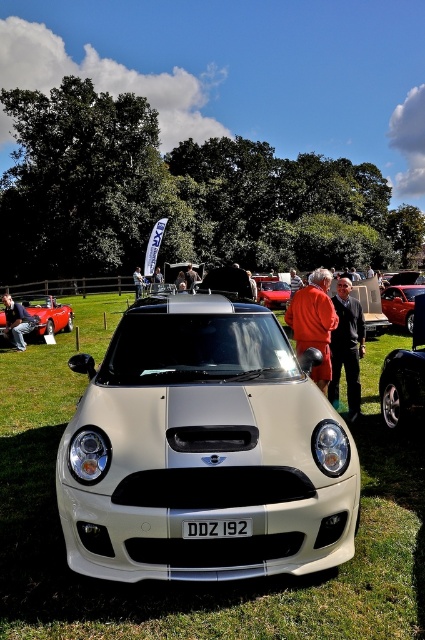
Looking at this image, who is more distant from viewer, (190, 532) or (10, 321)?

The point (10, 321) is more distant.

What do you see at coordinates (217, 529) in the screenshot?
I see `white plastic license plate at center` at bounding box center [217, 529].

Identify the location of white plastic license plate at center. The image size is (425, 640). click(217, 529).

Is dark brown leather jacket at center above denim jacket at lower left?

No, dark brown leather jacket at center is not above denim jacket at lower left.

Which is more to the left, dark brown leather jacket at center or denim jacket at lower left?

From the viewer's perspective, denim jacket at lower left appears more on the left side.

Who is more distant from viewer, (353, 372) or (5, 296)?

The point (5, 296) is behind.

This screenshot has width=425, height=640. I want to click on dark brown leather jacket at center, so coord(346,348).

Who is more forward, (300, 292) or (384, 308)?

Point (300, 292) is more forward.

Is point (328, 364) less distant than point (391, 304)?

Yes.

The width and height of the screenshot is (425, 640). What are the coordinates of `orange fabric coat at center` in the screenshot? It's located at (314, 323).